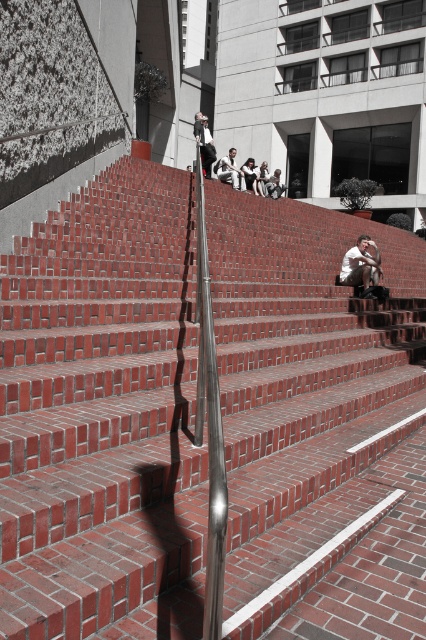
You are a photographer trying to capture two shirts in the scene. The matte white shirt at center and the white cotton shirt at center. Which shirt would appear narrower when photographed from the front?

The matte white shirt at center is thinner than the white cotton shirt at center, so it would appear narrower when photographed from the front.

You are standing at the base of the red brick stairs leading to the modern building. You want to take a photo of the point at coordinates point (365, 289). Your camera has a focal length of 50mm and a sensor size of 24mm. What is the minimum distance you need to move forward or backward to ensure the point is in focus?

The point at point (365, 289) is currently 9.03 meters away from the camera. To ensure it is in focus, you need to adjust your position so that the camera is exactly 9.03 meters away from the point. Since the camera is already at that distance, no adjustment is needed. However, if the focus requires a specific plane, you might need to align the camera precisely at that distance.

Based on the photo, you are standing at the bottom of the red brick stairs and looking up. You see two people wearing white shirts. One is labeled as the matte white shirt at center and the other as the white shirt at upper center. Which of these two shirts is higher up?

The white shirt at upper center is higher up than the matte white shirt at center.